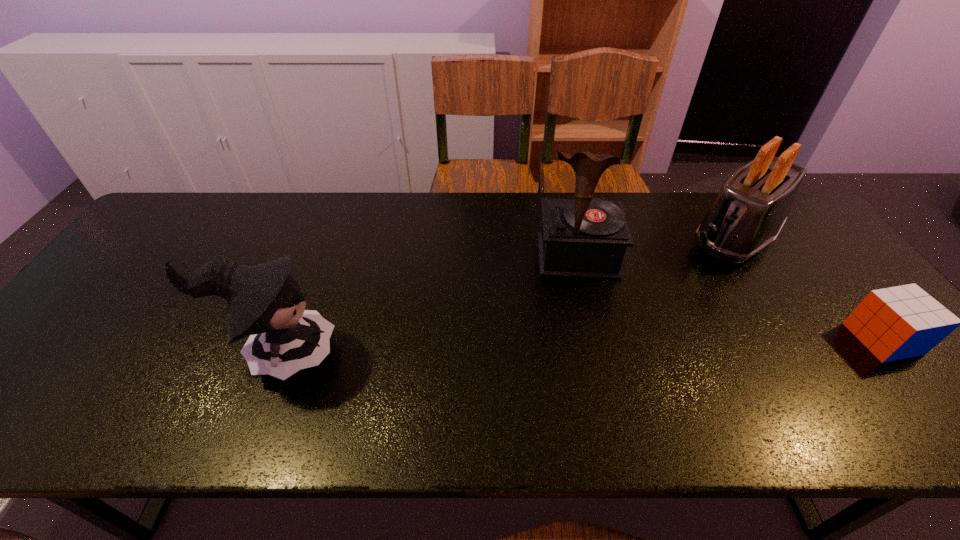
The width and height of the screenshot is (960, 540). I want to click on doll, so click(264, 301).

Where is `cube`? This screenshot has width=960, height=540. cube is located at coordinates (894, 323).

The width and height of the screenshot is (960, 540). Find the location of `phonograph_record`. phonograph_record is located at coordinates (582, 238).

At what (x,y) coordinates should I click in order to perform the action: click on toaster. Please return your answer as a coordinate pair (x, y). This screenshot has width=960, height=540. Looking at the image, I should click on (752, 207).

The height and width of the screenshot is (540, 960). In order to click on free region located at the face of the leftmost object in this screenshot , I will do `click(393, 354)`.

This screenshot has width=960, height=540. Find the location of `vacant region located on the left of the cube`. vacant region located on the left of the cube is located at coordinates (742, 339).

You are a GUI agent. You are given a task and a screenshot of the screen. Output one action in this format:
    pyautogui.click(x=<x>, y=<y>)
    Task: Click on the free spot located at the horn opening of the phonograph_record
    This screenshot has width=960, height=540.
    Given the screenshot: What is the action you would take?
    pyautogui.click(x=584, y=303)

Where is `vacant space located at the horn opening of the phonograph_record`? The width and height of the screenshot is (960, 540). vacant space located at the horn opening of the phonograph_record is located at coordinates (585, 309).

You are a GUI agent. You are given a task and a screenshot of the screen. Output one action in this format:
    pyautogui.click(x=<x>, y=<y>)
    Task: Click on the vacant position located 0.060m at the horn opening of the phonograph_record
    
    Given the screenshot: What is the action you would take?
    pyautogui.click(x=583, y=298)

Where is `free space located on the side of the toaster with the control lever`? This screenshot has height=540, width=960. free space located on the side of the toaster with the control lever is located at coordinates (652, 315).